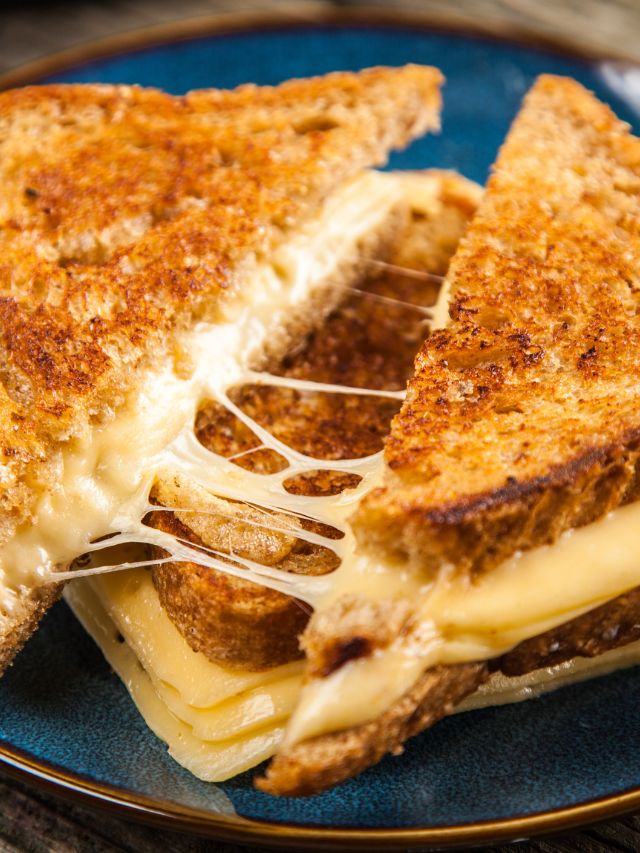
Identify the location of brown table. (58, 832).